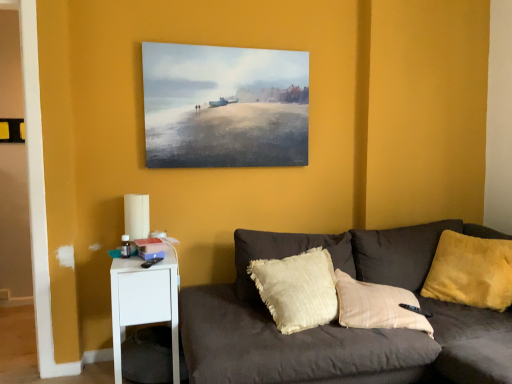
Question: In terms of height, does yellow plush pillow at right look taller or shorter compared to dark gray fabric couch at lower right?

Choices:
 (A) short
 (B) tall

Answer: (B)

Question: Based on their positions, is yellow plush pillow at right located to the left or right of dark gray fabric couch at lower right?

Choices:
 (A) right
 (B) left

Answer: (A)

Question: Which is farther from the white paper lampshade at left?

Choices:
 (A) white plastic nightstand at lower left
 (B) dark gray fabric couch at lower right
 (C) yellow plush pillow at right
 (D) watercolor painting at upper center

Answer: (C)

Question: Based on their relative distances, which object is nearer to the white plastic nightstand at lower left?

Choices:
 (A) yellow plush pillow at right
 (B) watercolor painting at upper center
 (C) dark gray fabric couch at lower right
 (D) white paper lampshade at left

Answer: (D)